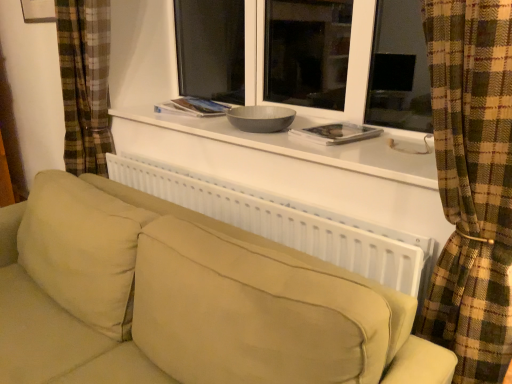
What do you see at coordinates (337, 133) in the screenshot?
I see `white paper book at center, marked as the first book in a bottom-to-top arrangement` at bounding box center [337, 133].

You are a GUI agent. You are given a task and a screenshot of the screen. Output one action in this format:
    pyautogui.click(x=<x>, y=<y>)
    Task: Click on the beige fabric couch at center
    The width and height of the screenshot is (512, 384).
    Given the screenshot: What is the action you would take?
    pyautogui.click(x=195, y=304)

The image size is (512, 384). Identify the location of white matte window sill at upper center. (309, 146).

The height and width of the screenshot is (384, 512). What do you see at coordinates (287, 222) in the screenshot? I see `white plastic radiator at center` at bounding box center [287, 222].

The image size is (512, 384). What are the coordinates of `white plastic radiator at center` in the screenshot? It's located at pos(287,222).

Locate an element on the screen. white paper book at center, which ranks as the 1th book in right-to-left order is located at coordinates (337, 133).

Which of these two, beige fabric couch at center or white plastic radiator at center, is thinner?

Thinner between the two is white plastic radiator at center.

At what (x,y) coordinates should I click in order to perform the action: click on studio couch that is in front of the white plastic radiator at center. Please return your answer as a coordinate pair (x, y). The image size is (512, 384). Looking at the image, I should click on (195, 304).

In terms of height, does beige fabric couch at center look taller or shorter compared to white plastic radiator at center?

Considering their sizes, beige fabric couch at center has more height than white plastic radiator at center.

How many degrees apart are the facing directions of beige fabric couch at center and white plastic radiator at center?

beige fabric couch at center and white plastic radiator at center are facing 0.462 degrees away from each other.

Looking at this image, is hardcover book at center, the second book when ordered from bottom to top, thinner than white paper book at center, which is the 2th book in top-to-bottom order?

No.

From the image's perspective, between hardcover book at center, the 1th book from the left, and white paper book at center, which is the 2th book in top-to-bottom order, who is located below?

white paper book at center, which is the 2th book in top-to-bottom order, is shown below in the image.

Considering the sizes of objects hardcover book at center, positioned as the 2th book in right-to-left order, and white paper book at center, placed as the second book when sorted from back to front, in the image provided, who is shorter, hardcover book at center, positioned as the 2th book in right-to-left order, or white paper book at center, placed as the second book when sorted from back to front,?

white paper book at center, placed as the second book when sorted from back to front, is shorter.

Does hardcover book at center, the 1th book when ordered from top to bottom, turn towards white paper book at center, which is the first book from front to back?

No, hardcover book at center, the 1th book when ordered from top to bottom, is not oriented towards white paper book at center, which is the first book from front to back.

Consider the image. In the image, is white matte window sill at upper center positioned in front of or behind white paper book at center, which is the 2th book in top-to-bottom order?

Visually, white matte window sill at upper center is located in front of white paper book at center, which is the 2th book in top-to-bottom order.

How many degrees apart are the facing directions of white matte window sill at upper center and white paper book at center, which is the 2th book in top-to-bottom order?

The facing directions of white matte window sill at upper center and white paper book at center, which is the 2th book in top-to-bottom order, are 13.3 degrees apart.

Which of these two, white matte window sill at upper center or white paper book at center, which ranks as the 1th book in right-to-left order, is wider?

Wider between the two is white matte window sill at upper center.

Can we say white matte window sill at upper center lies outside white paper book at center, which is the first book from front to back?

Yes, white matte window sill at upper center is not within white paper book at center, which is the first book from front to back.

Would you say beige fabric couch at center is inside or outside white matte window sill at upper center?

beige fabric couch at center cannot be found inside white matte window sill at upper center.

Considering the sizes of beige fabric couch at center and white matte window sill at upper center in the image, is beige fabric couch at center wider or thinner than white matte window sill at upper center?

In the image, beige fabric couch at center appears to be wider than white matte window sill at upper center.

Is the position of beige fabric couch at center less distant than that of white matte window sill at upper center?

That is True.

Which of these two, beige fabric couch at center or white matte window sill at upper center, stands shorter?

With less height is white matte window sill at upper center.

Based on the photo, does white paper book at center, which ranks as the 1th book in right-to-left order, have a greater height compared to white matte window sill at upper center?

No.

From a real-world perspective, which is physically below, white paper book at center, which is the first book from front to back, or white matte window sill at upper center?

white matte window sill at upper center, from a real-world perspective.

How different are the orientations of white paper book at center, placed as the second book when sorted from back to front, and white matte window sill at upper center in degrees?

13.3 degrees.

Which of these two, white paper book at center, placed as the second book when sorted from back to front, or white matte window sill at upper center, is bigger?

Bigger between the two is white matte window sill at upper center.

Does beige fabric couch at center come behind white paper book at center, which is the first book from front to back?

No, beige fabric couch at center is in front of white paper book at center, which is the first book from front to back.

How different are the orientations of beige fabric couch at center and white paper book at center, which ranks as the 1th book in right-to-left order, in degrees?

They differ by 13.8 degrees in their facing directions.

Is white paper book at center, marked as the 2th book in a left-to-right arrangement, inside beige fabric couch at center?

No, white paper book at center, marked as the 2th book in a left-to-right arrangement, is located outside of beige fabric couch at center.

Locate an element on the screen. This screenshot has height=384, width=512. studio couch in front of the white paper book at center, marked as the 2th book in a left-to-right arrangement is located at coordinates (195, 304).

Where is `studio couch below the white plastic radiator at center (from the image's perspective)`? The image size is (512, 384). studio couch below the white plastic radiator at center (from the image's perspective) is located at coordinates (195, 304).

Is white plastic radiator at center at the right side of beige fabric couch at center?

Yes.

Is the position of white plastic radiator at center less distant than that of beige fabric couch at center?

No, white plastic radiator at center is behind beige fabric couch at center.

From the image's perspective, which one is positioned higher, white plastic radiator at center or beige fabric couch at center?

From the image's view, white plastic radiator at center is above.

The width and height of the screenshot is (512, 384). Find the location of `radiator on the right side of beige fabric couch at center`. radiator on the right side of beige fabric couch at center is located at coordinates (287, 222).

Locate an element on the screen. book above the white paper book at center, which ranks as the 1th book in right-to-left order (from the image's perspective) is located at coordinates (193, 107).

Looking at the image, which one is located closer to hardcover book at center, which appears as the 2th book when viewed from the front, white plastic radiator at center or white paper book at center, marked as the 2th book in a left-to-right arrangement?

white plastic radiator at center lies closer to hardcover book at center, which appears as the 2th book when viewed from the front, than the other object.

Estimate the real-world distances between objects in this image. Which object is closer to hardcover book at center, the 1th book when ordered from top to bottom, white matte window sill at upper center or beige fabric couch at center?

white matte window sill at upper center.

Based on their spatial positions, is hardcover book at center, the 1th book positioned from the back, or white plastic radiator at center further from white paper book at center, which is the first book from front to back?

hardcover book at center, the 1th book positioned from the back, is positioned further to the anchor white paper book at center, which is the first book from front to back.

Estimate the real-world distances between objects in this image. Which object is further from white paper book at center, marked as the 2th book in a left-to-right arrangement, hardcover book at center, the 1th book from the left, or white matte window sill at upper center?

hardcover book at center, the 1th book from the left, lies further to white paper book at center, marked as the 2th book in a left-to-right arrangement, than the other object.

Based on their spatial positions, is white plastic radiator at center or beige fabric couch at center closer to white matte window sill at upper center?

white plastic radiator at center lies closer to white matte window sill at upper center than the other object.

Looking at the image, which one is located closer to white matte window sill at upper center, hardcover book at center, the second book when ordered from bottom to top, or beige fabric couch at center?

hardcover book at center, the second book when ordered from bottom to top, is closer to white matte window sill at upper center.

Considering their positions, is beige fabric couch at center positioned further to hardcover book at center, positioned as the 2th book in right-to-left order, than white matte window sill at upper center?

beige fabric couch at center is further to hardcover book at center, positioned as the 2th book in right-to-left order.

Based on their spatial positions, is white matte window sill at upper center or white plastic radiator at center further from hardcover book at center, positioned as the 2th book in right-to-left order?

white plastic radiator at center lies further to hardcover book at center, positioned as the 2th book in right-to-left order, than the other object.

What are the coordinates of `radiator between beige fabric couch at center and white paper book at center, which is the first book from front to back, in the front-back direction` in the screenshot? It's located at (287, 222).

Where is `book between beige fabric couch at center and hardcover book at center, the 1th book positioned from the back, along the z-axis`? The width and height of the screenshot is (512, 384). book between beige fabric couch at center and hardcover book at center, the 1th book positioned from the back, along the z-axis is located at coordinates (337, 133).

Locate an element on the screen. This screenshot has height=384, width=512. window sill between beige fabric couch at center and white plastic radiator at center from front to back is located at coordinates (309, 146).

Identify the location of book positioned between white matte window sill at upper center and hardcover book at center, the 1th book when ordered from top to bottom, from near to far. (337, 133).